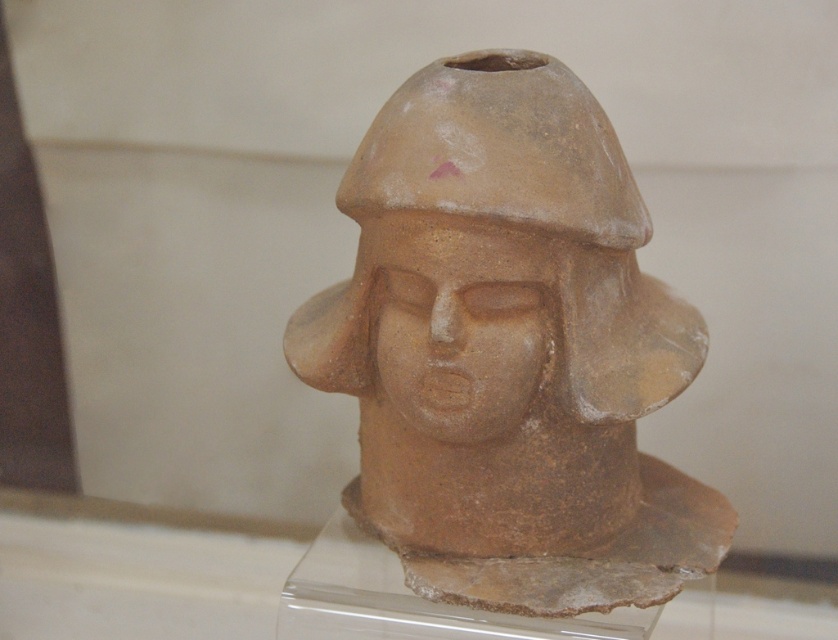
Question: Does matte clay bust at center appear under matte clay face at center?

Choices:
 (A) yes
 (B) no

Answer: (A)

Question: Does matte clay bust at center have a greater width compared to matte clay face at center?

Choices:
 (A) yes
 (B) no

Answer: (A)

Question: Which of the following is the farthest from the observer?

Choices:
 (A) matte clay bust at center
 (B) matte clay face at center

Answer: (B)

Question: Among these points, which one is farthest from the camera?

Choices:
 (A) (453, 496)
 (B) (530, 282)

Answer: (A)

Question: Does matte clay bust at center appear over matte clay face at center?

Choices:
 (A) yes
 (B) no

Answer: (B)